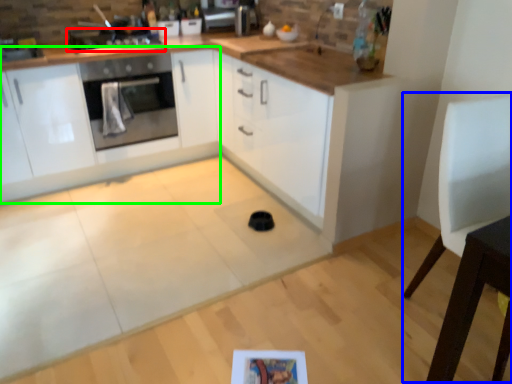
Question: Considering the real-world distances, which object is closest to kitchen appliance (highlighted by a red box)? chair (highlighted by a blue box) or cabinetry (highlighted by a green box).

Choices:
 (A) chair
 (B) cabinetry

Answer: (B)